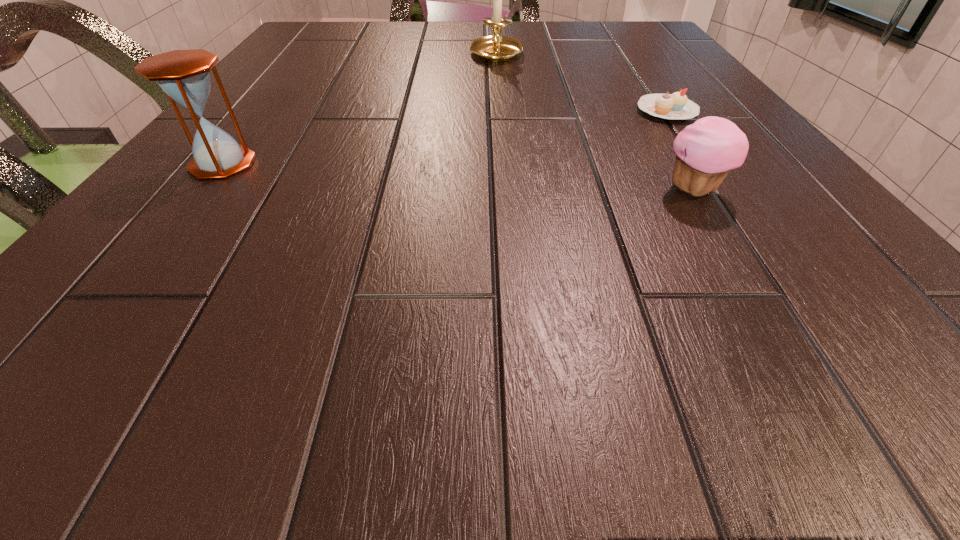
This screenshot has height=540, width=960. I want to click on the leftmost object, so click(x=184, y=76).

Where is `the third object from right to left`? This screenshot has height=540, width=960. the third object from right to left is located at coordinates (496, 48).

The width and height of the screenshot is (960, 540). Identify the location of candle holder. (496, 48).

Find the location of a particular element. the taller cupcake is located at coordinates (706, 151).

Where is `the nearer cupcake`? Image resolution: width=960 pixels, height=540 pixels. the nearer cupcake is located at coordinates (706, 151).

The height and width of the screenshot is (540, 960). I want to click on the shorter cupcake, so click(x=676, y=106).

Where is `the second farthest object`? This screenshot has height=540, width=960. the second farthest object is located at coordinates (676, 106).

This screenshot has width=960, height=540. In order to click on vacant point located 0.150m on the right of the leftmost object in this screenshot , I will do `click(354, 164)`.

Where is `vacant point located on the handle side of the second object from left to right`? vacant point located on the handle side of the second object from left to right is located at coordinates (499, 92).

Where is `vacant area situated 0.360m on the left of the nearer cupcake`? The image size is (960, 540). vacant area situated 0.360m on the left of the nearer cupcake is located at coordinates (401, 190).